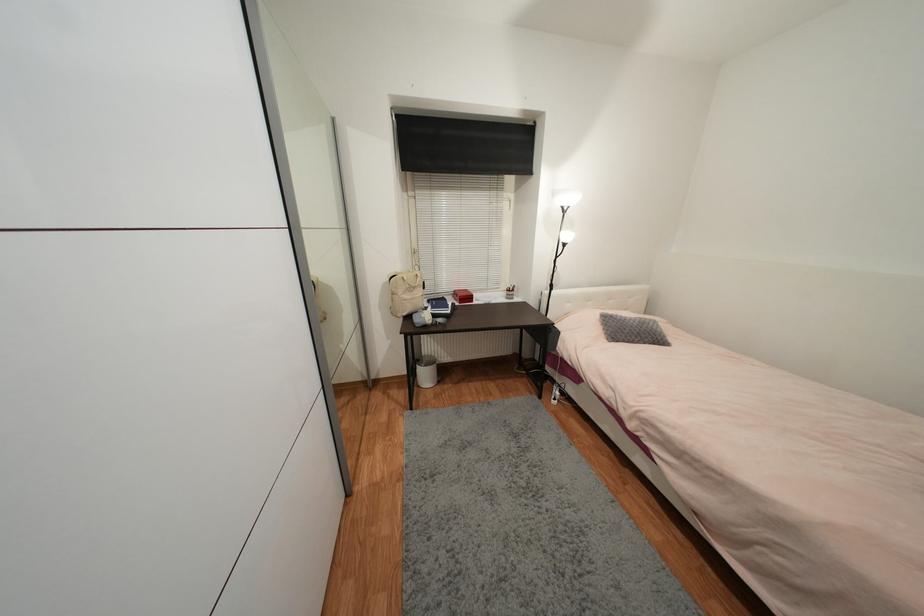
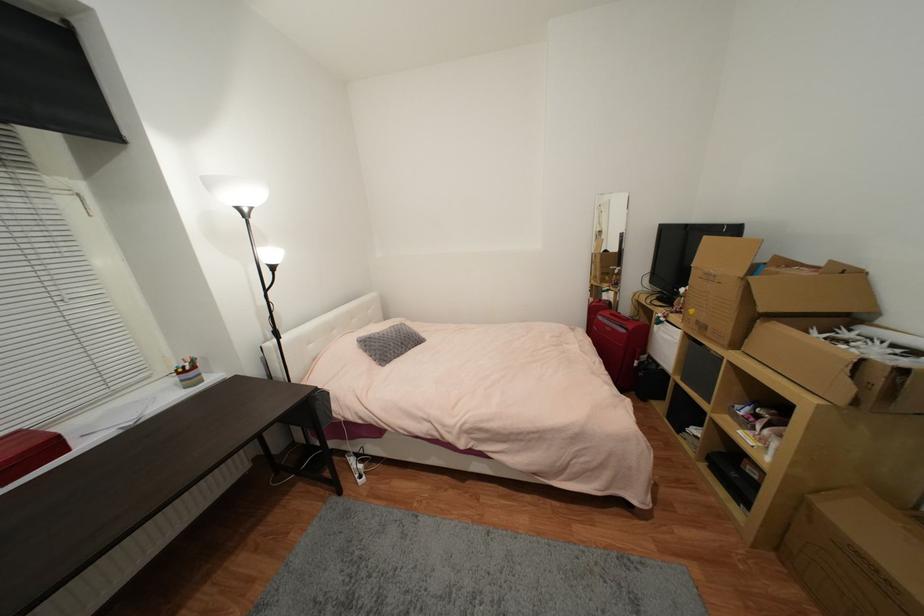
The point at (555,291) is marked in the first image. Where is the corresponding point in the second image?

(283, 339)